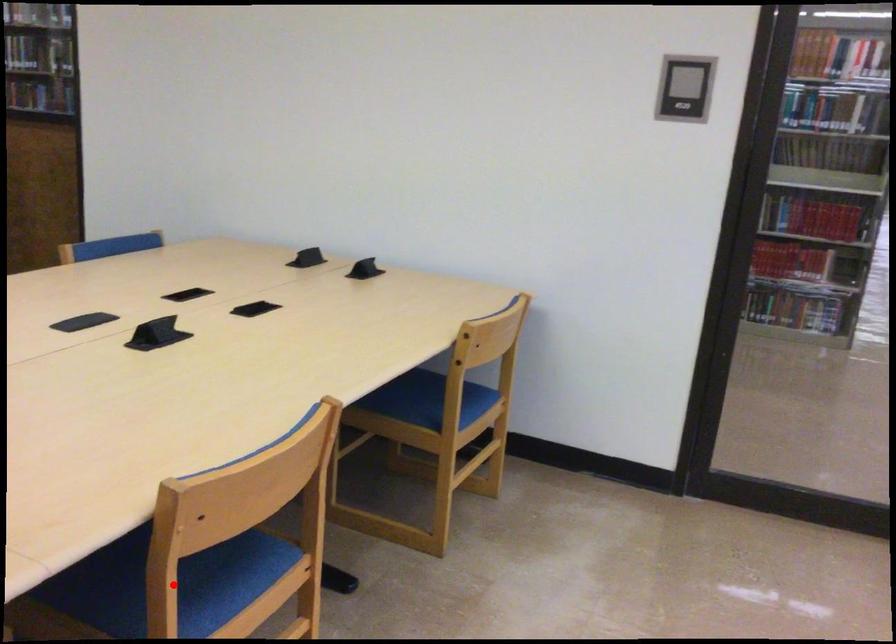
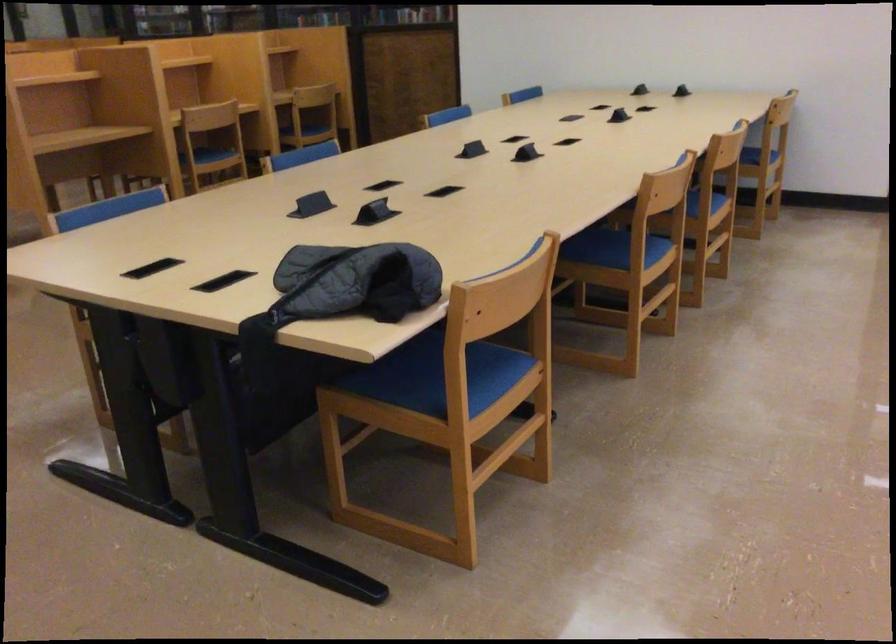
Question: I am providing you with two images of the same scene from different viewpoints. A red point is marked on the first image. At the location where the point appears in image 1, is it still visible in image 2?

Choices:
 (A) Yes
 (B) No

Answer: (B)